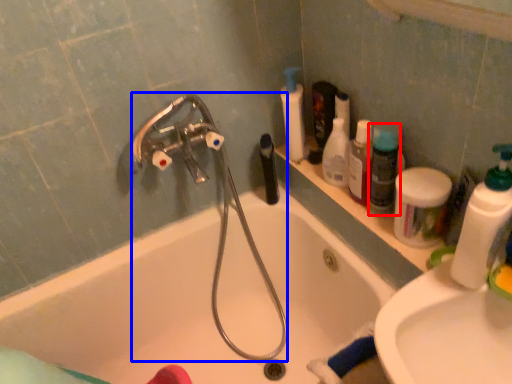
Question: Which of the following is the farthest to the observer, cleaning product (highlighted by a red box) or garden hose (highlighted by a blue box)?

Choices:
 (A) cleaning product
 (B) garden hose

Answer: (A)